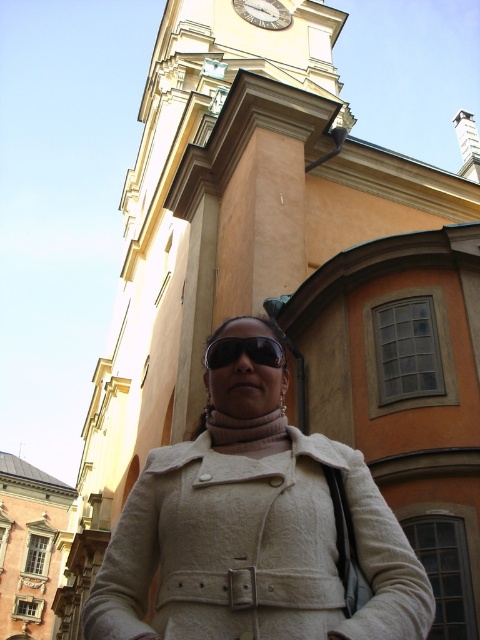
Does point (288, 497) lie in front of point (242, 340)?

That is True.

Between point (217, 609) and point (280, 360), which one is positioned behind?

Point (280, 360)

You are a GUI agent. You are given a task and a screenshot of the screen. Output one action in this format:
    pyautogui.click(x=<x>, y=<y>)
    Task: Click on the white woolen coat at center
    
    Given the screenshot: What is the action you would take?
    pyautogui.click(x=253, y=532)

Does white woolen coat at center have a lesser height compared to metallic clock face at upper center?

No.

Is white woolen coat at center to the left of metallic clock face at upper center from the viewer's perspective?

Yes, white woolen coat at center is to the left of metallic clock face at upper center.

Which is in front, point (310, 595) or point (269, 6)?

Positioned in front is point (310, 595).

Image resolution: width=480 pixels, height=640 pixels. Find the location of `white woolen coat at center`. white woolen coat at center is located at coordinates (253, 532).

The image size is (480, 640). Describe the element at coordinates (243, 352) in the screenshot. I see `black reflective sunglasses at center` at that location.

Between point (273, 340) and point (253, 10), which one is positioned in front?

Positioned in front is point (273, 340).

At what (x,y) coordinates should I click in order to perform the action: click on black reflective sunglasses at center. Please return your answer as a coordinate pair (x, y). The width and height of the screenshot is (480, 640). Looking at the image, I should click on (243, 352).